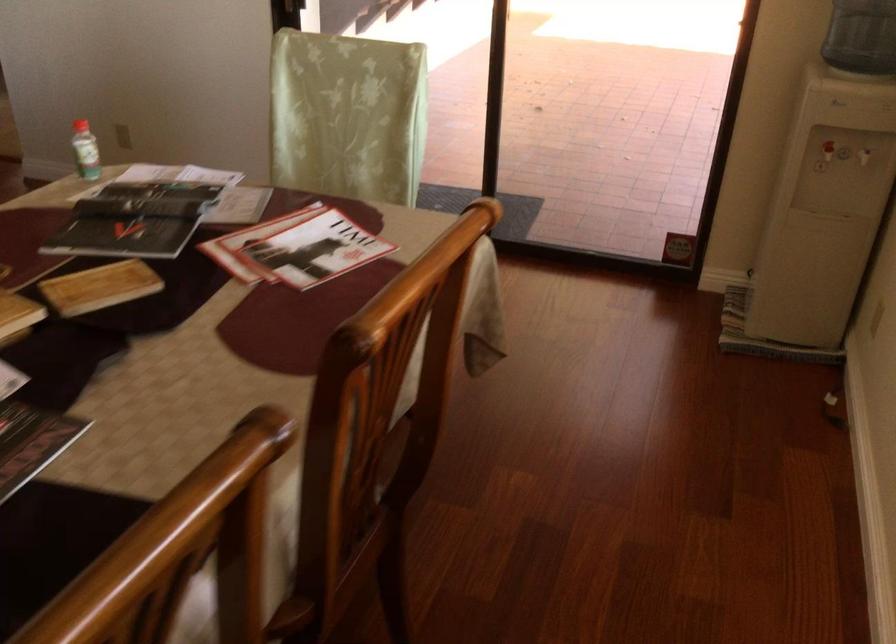
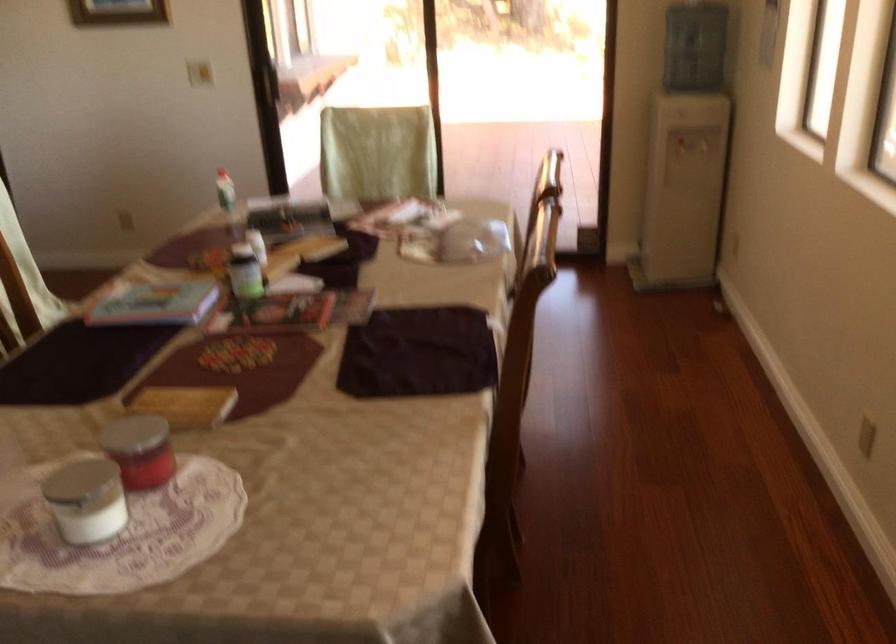
Based on the photo, which direction would the cameraman need to move to produce the second image?

The cameraman moved toward left, backward.